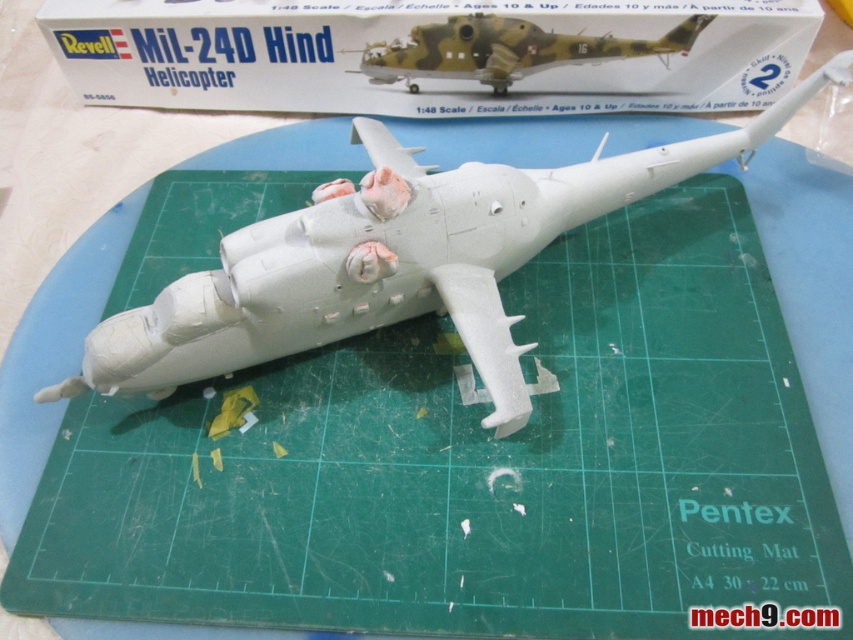
Question: Based on their relative distances, which object is farther from the matte white plastic box at upper center?

Choices:
 (A) white matte helicopter at center
 (B) camouflage plastic helicopter at center

Answer: (A)

Question: Which object is positioned closest to the matte white plastic box at upper center?

Choices:
 (A) camouflage plastic helicopter at center
 (B) white matte helicopter at center

Answer: (A)

Question: Does matte white plastic box at upper center appear on the right side of camouflage plastic helicopter at center?

Choices:
 (A) no
 (B) yes

Answer: (A)

Question: Can you confirm if matte white plastic box at upper center is thinner than white matte helicopter at center?

Choices:
 (A) yes
 (B) no

Answer: (B)

Question: Based on their relative distances, which object is farther from the matte white plastic box at upper center?

Choices:
 (A) camouflage plastic helicopter at center
 (B) white matte helicopter at center

Answer: (B)

Question: Can you confirm if matte white plastic box at upper center is smaller than camouflage plastic helicopter at center?

Choices:
 (A) yes
 (B) no

Answer: (B)